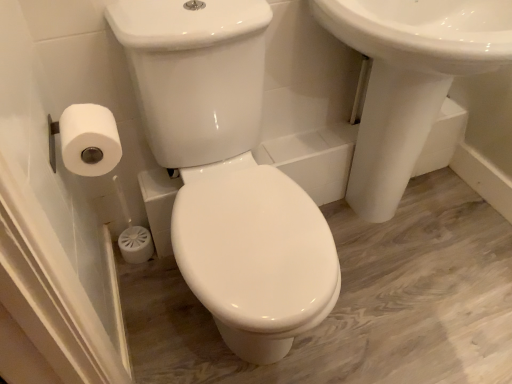
What are the coordinates of `vacant space in between white glossy toilet at center and white glossy sink at upper right` in the screenshot? It's located at (395, 309).